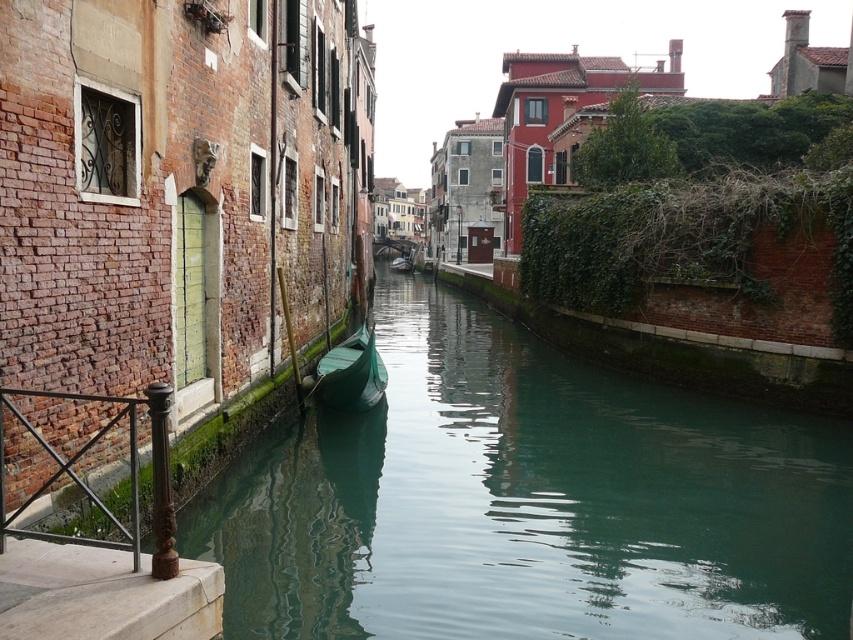
You are a tour guide leading a group along the canal. You want to point out the distance between the brown wrought iron railing at lower left and the green matte boat at center. How far apart are they?

The brown wrought iron railing at lower left and the green matte boat at center are 11.90 meters apart.